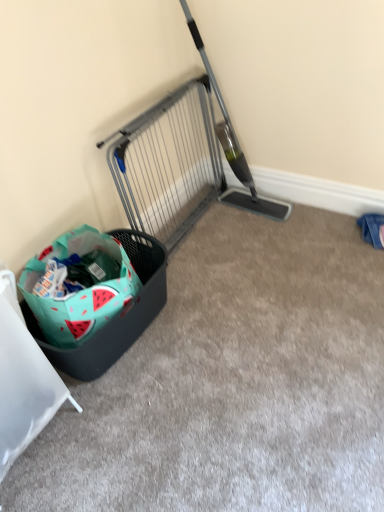
Measure the distance between point [19,397] and camera.

1.21 meters.

Locate an element on the screen. The height and width of the screenshot is (512, 384). metallic gray gate at upper center is located at coordinates (168, 163).

The width and height of the screenshot is (384, 512). In order to click on teal fabric basket at lower left in this screenshot , I will do `click(23, 380)`.

Is metallic gray gate at upper center spatially inside teal fabric basket at lower left, or outside of it?

metallic gray gate at upper center is not inside teal fabric basket at lower left, it's outside.

Does metallic gray gate at upper center have a greater width compared to teal fabric basket at lower left?

No.

Is metallic gray gate at upper center next to teal fabric basket at lower left?

metallic gray gate at upper center and teal fabric basket at lower left are not in contact.

Does teal fabric basket at lower left have a larger size compared to metallic gray gate at upper center?

Indeed, teal fabric basket at lower left has a larger size compared to metallic gray gate at upper center.

Is there a large distance between teal fabric basket at lower left and metallic gray gate at upper center?

Yes, teal fabric basket at lower left and metallic gray gate at upper center are quite far apart.

From the image's perspective, which one is positioned lower, teal fabric basket at lower left or metallic gray gate at upper center?

teal fabric basket at lower left is shown below in the image.

Who is shorter, teal fabric basket at lower left or metallic gray gate at upper center?

metallic gray gate at upper center is shorter.

From a real-world perspective, between teal fabric basket at lower left and watermelon-patterned fabric shopping bag at lower left, who is vertically higher?

In real-world perspective, teal fabric basket at lower left is above.

Is teal fabric basket at lower left smaller than watermelon-patterned fabric shopping bag at lower left?

No, teal fabric basket at lower left is not smaller than watermelon-patterned fabric shopping bag at lower left.

Measure the distance between watermelon-patterned fabric shopping bag at lower left and teal fabric basket at lower left.

The distance of watermelon-patterned fabric shopping bag at lower left from teal fabric basket at lower left is 11.95 inches.

Considering the positions of objects watermelon-patterned fabric shopping bag at lower left and teal fabric basket at lower left in the image provided, who is more to the right, watermelon-patterned fabric shopping bag at lower left or teal fabric basket at lower left?

From the viewer's perspective, watermelon-patterned fabric shopping bag at lower left appears more on the right side.

Can you see watermelon-patterned fabric shopping bag at lower left touching teal fabric basket at lower left?

No, watermelon-patterned fabric shopping bag at lower left is not making contact with teal fabric basket at lower left.

Is watermelon-patterned fabric shopping bag at lower left looking in the opposite direction of teal fabric basket at lower left?

watermelon-patterned fabric shopping bag at lower left does not have its back to teal fabric basket at lower left.

From their relative heights in the image, would you say metallic gray gate at upper center is taller or shorter than watermelon-patterned fabric shopping bag at lower left?

metallic gray gate at upper center is taller than watermelon-patterned fabric shopping bag at lower left.

Can you confirm if metallic gray gate at upper center is wider than watermelon-patterned fabric shopping bag at lower left?

No, metallic gray gate at upper center is not wider than watermelon-patterned fabric shopping bag at lower left.

From a real-world perspective, is metallic gray gate at upper center physically above watermelon-patterned fabric shopping bag at lower left?

Correct, in the physical world, metallic gray gate at upper center is higher than watermelon-patterned fabric shopping bag at lower left.

Considering their positions, is metallic gray gate at upper center located in front of or behind watermelon-patterned fabric shopping bag at lower left?

metallic gray gate at upper center is behind watermelon-patterned fabric shopping bag at lower left.

Does watermelon-patterned fabric shopping bag at lower left turn towards metallic gray gate at upper center?

No.

Measure the distance from watermelon-patterned fabric shopping bag at lower left to metallic gray gate at upper center.

20.84 inches.

From a real-world perspective, is watermelon-patterned fabric shopping bag at lower left located higher than metallic gray gate at upper center?

No.

Is point (57, 280) positioned after point (194, 90)?

No, (57, 280) is closer to viewer.

At what (x,y) coordinates should I click in order to perform the action: click on cage above the teal fabric basket at lower left (from the image's perspective). Please return your answer as a coordinate pair (x, y). Image resolution: width=384 pixels, height=512 pixels. Looking at the image, I should click on (168, 163).

Image resolution: width=384 pixels, height=512 pixels. I want to click on cage behind the teal fabric basket at lower left, so (x=168, y=163).

Based on their spatial positions, is teal fabric basket at lower left or metallic gray gate at upper center closer to watermelon-patterned fabric shopping bag at lower left?

teal fabric basket at lower left lies closer to watermelon-patterned fabric shopping bag at lower left than the other object.

From the image, which object appears to be farther from teal fabric basket at lower left, watermelon-patterned fabric shopping bag at lower left or metallic gray gate at upper center?

Based on the image, metallic gray gate at upper center appears to be further to teal fabric basket at lower left.

When comparing their distances from metallic gray gate at upper center, does teal fabric basket at lower left or watermelon-patterned fabric shopping bag at lower left seem further?

teal fabric basket at lower left.

Which object lies further to the anchor point watermelon-patterned fabric shopping bag at lower left, metallic gray gate at upper center or teal fabric basket at lower left?

Based on the image, metallic gray gate at upper center appears to be further to watermelon-patterned fabric shopping bag at lower left.

Estimate the real-world distances between objects in this image. Which object is further from teal fabric basket at lower left, metallic gray gate at upper center or watermelon-patterned fabric shopping bag at lower left?

metallic gray gate at upper center is further to teal fabric basket at lower left.

Based on their spatial positions, is watermelon-patterned fabric shopping bag at lower left or teal fabric basket at lower left closer to metallic gray gate at upper center?

watermelon-patterned fabric shopping bag at lower left.

I want to click on shopping bag between metallic gray gate at upper center and teal fabric basket at lower left vertically, so click(78, 285).